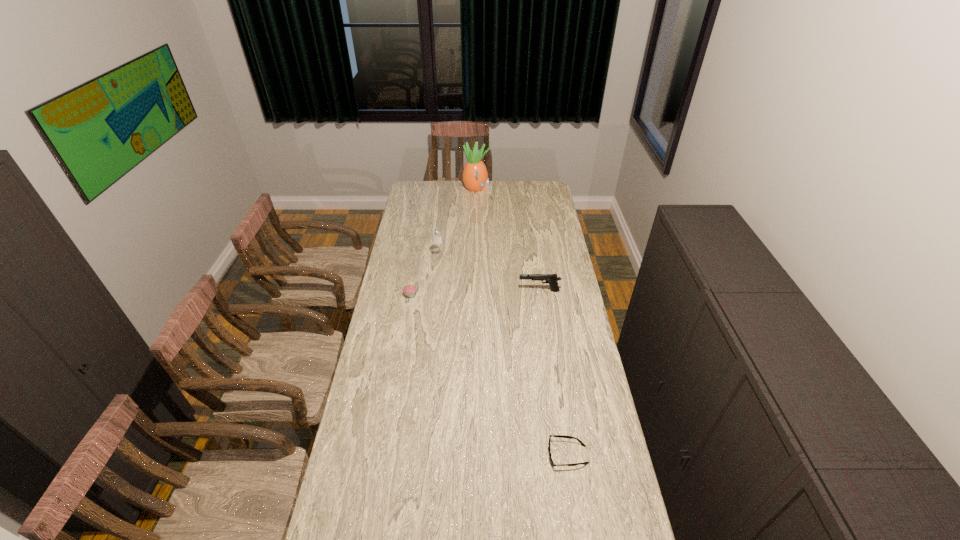
Locate an element on the screen. The height and width of the screenshot is (540, 960). free space between the shortest object and the cupcake is located at coordinates (490, 375).

Identify the location of vacant point located between the sunglasses and the second tallest object. The width and height of the screenshot is (960, 540). (503, 356).

The image size is (960, 540). I want to click on empty location between the water bottle and the gun, so click(x=489, y=274).

Locate an element on the screen. Image resolution: width=960 pixels, height=540 pixels. vacant space in between the leftmost object and the gun is located at coordinates (475, 293).

The width and height of the screenshot is (960, 540). Find the location of `unoccupied area between the leftmost object and the sunglasses`. unoccupied area between the leftmost object and the sunglasses is located at coordinates (490, 375).

Where is `vacant space in between the sunglasses and the leftmost object`? vacant space in between the sunglasses and the leftmost object is located at coordinates (490, 375).

Point out which object is positioned as the second nearest to the fourth tallest object. Please provide its 2D coordinates. Your answer should be formatted as a tuple, i.e. [(x, y)], where the tuple contains the x and y coordinates of a point satisfying the conditions above.

[(551, 279)]

Choose which object is the nearest neighbor to the shortest object. Please provide its 2D coordinates. Your answer should be formatted as a tuple, i.e. [(x, y)], where the tuple contains the x and y coordinates of a point satisfying the conditions above.

[(551, 279)]

At what (x,y) coordinates should I click in order to perform the action: click on free space in the image that satisfies the following two spatial constraints: 1. at the entrance of the farthest object; 2. on the front side of the cupcake. Please return your answer as a coordinate pair (x, y). This screenshot has height=540, width=960. Looking at the image, I should click on [475, 295].